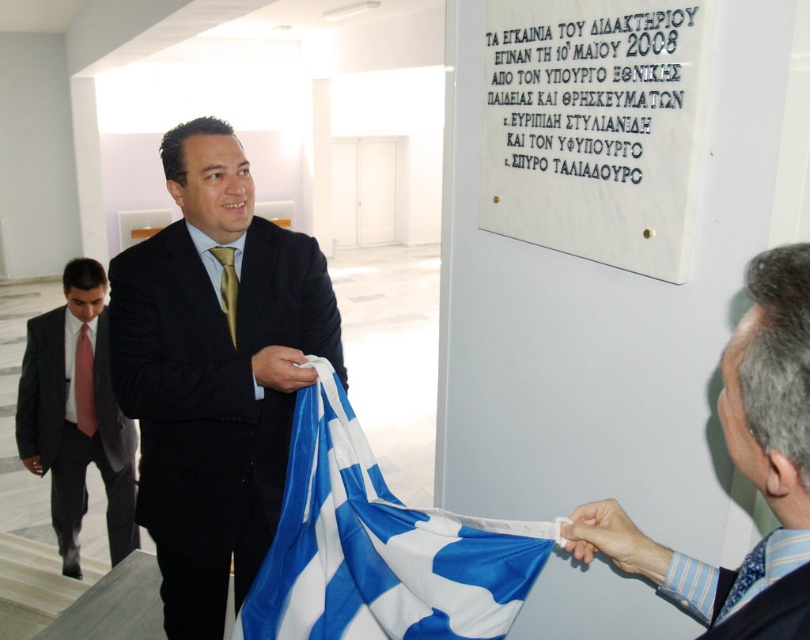
Question: Where is gold silk tie at center located in relation to blue silk tie at center in the image?

Choices:
 (A) above
 (B) below

Answer: (A)

Question: Does blue silk tie at upper right appear over blue silk tie at center?

Choices:
 (A) no
 (B) yes

Answer: (B)

Question: Does blue silk tie at upper right appear over blue silk tie at center?

Choices:
 (A) yes
 (B) no

Answer: (A)

Question: Which point is farther to the camera?

Choices:
 (A) black satin suit at center
 (B) blue silk tie at center
 (C) white matte paper at center

Answer: (A)

Question: Which of the following is the farthest from the observer?

Choices:
 (A) (87, 401)
 (B) (113, 547)

Answer: (A)

Question: Which of the following is the closest to the observer?

Choices:
 (A) click(228, 285)
 (B) click(352, 502)
 (C) click(617, 540)

Answer: (C)